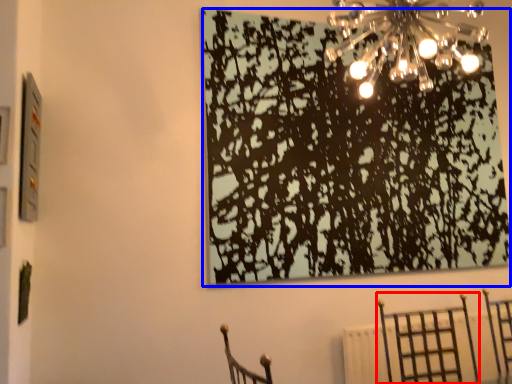
Question: Which point is closer to the camera, furniture (highlighted by a red box) or tree (highlighted by a blue box)?

Choices:
 (A) furniture
 (B) tree

Answer: (A)